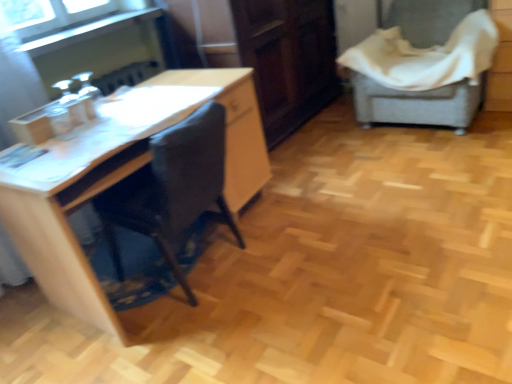
Question: From the image's perspective, does dark wood/file cabinet at center appear lower than wooden desk at left?

Choices:
 (A) no
 (B) yes

Answer: (A)

Question: Can we say dark wood/file cabinet at center lies outside wooden desk at left?

Choices:
 (A) yes
 (B) no

Answer: (A)

Question: Does dark wood/file cabinet at center have a greater height compared to wooden desk at left?

Choices:
 (A) yes
 (B) no

Answer: (A)

Question: Is dark wood/file cabinet at center facing towards wooden desk at left?

Choices:
 (A) yes
 (B) no

Answer: (B)

Question: From a real-world perspective, is dark wood/file cabinet at center below wooden desk at left?

Choices:
 (A) no
 (B) yes

Answer: (A)

Question: Does dark wood/file cabinet at center lie behind wooden desk at left?

Choices:
 (A) yes
 (B) no

Answer: (A)

Question: From a real-world perspective, does wooden desk at left stand above clear glass window at upper left?

Choices:
 (A) yes
 (B) no

Answer: (B)

Question: Are wooden desk at left and clear glass window at upper left far apart?

Choices:
 (A) no
 (B) yes

Answer: (A)

Question: Is wooden desk at left in front of clear glass window at upper left?

Choices:
 (A) yes
 (B) no

Answer: (A)

Question: From a real-world perspective, is wooden desk at left located beneath clear glass window at upper left?

Choices:
 (A) yes
 (B) no

Answer: (A)

Question: Is wooden desk at left next to clear glass window at upper left and touching it?

Choices:
 (A) no
 (B) yes

Answer: (A)

Question: Considering the relative positions of wooden desk at left and clear glass window at upper left in the image provided, is wooden desk at left behind clear glass window at upper left?

Choices:
 (A) yes
 (B) no

Answer: (B)

Question: Is dark wood/file cabinet at center wider than clear glass window at upper left?

Choices:
 (A) yes
 (B) no

Answer: (A)